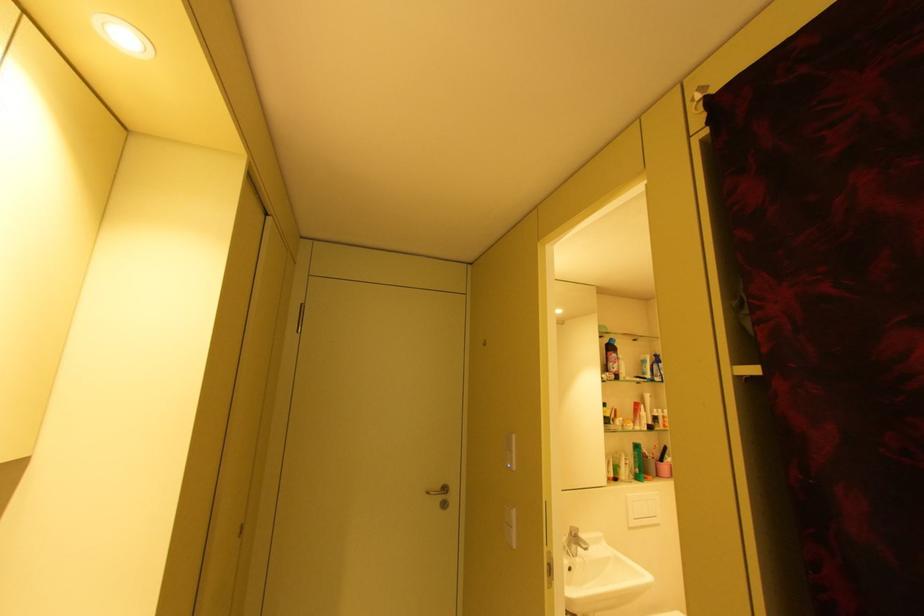
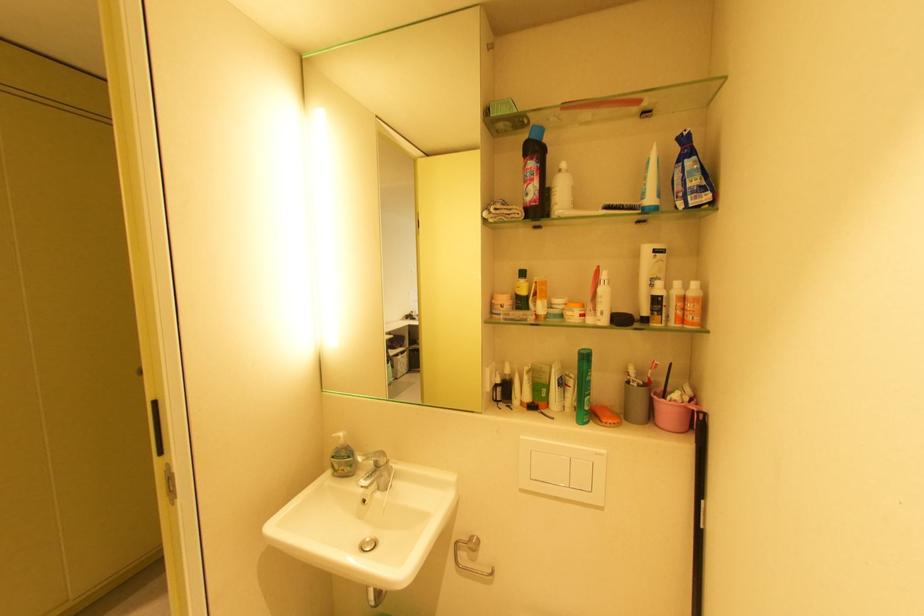
The point at (619,369) is marked in the first image. Where is the corresponding point in the second image?

(533, 196)